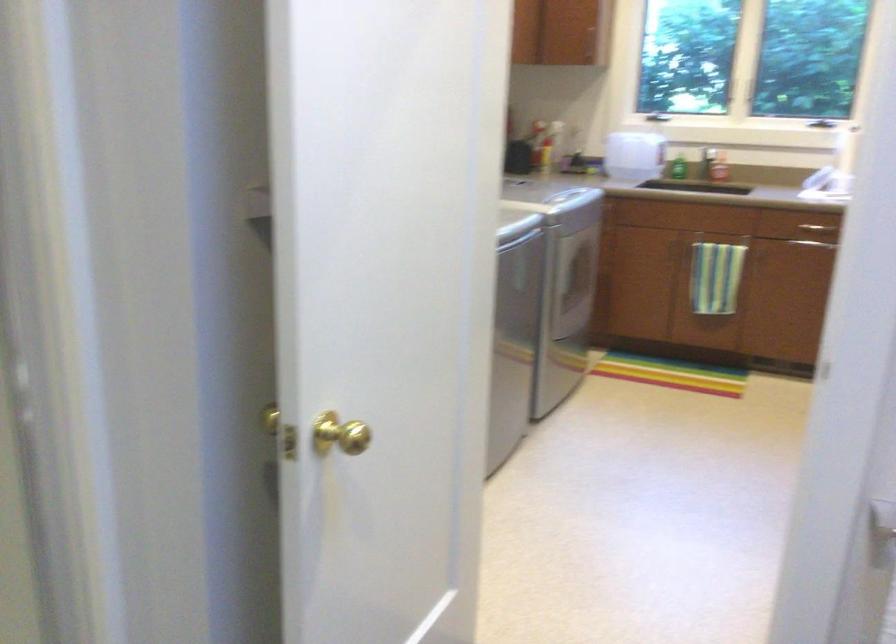
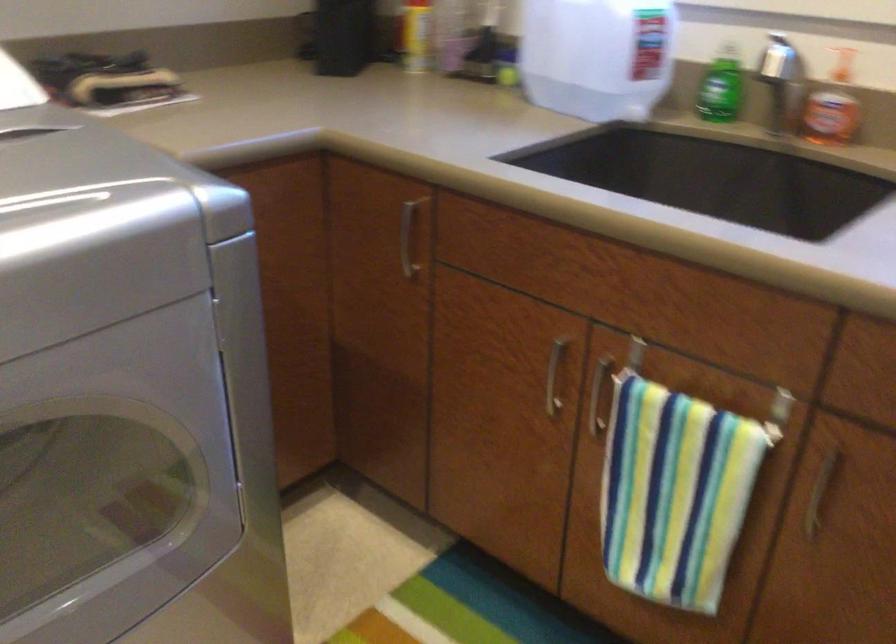
Locate, in the second image, the point that corresponds to the point at 677,161 in the first image.

(721, 88)